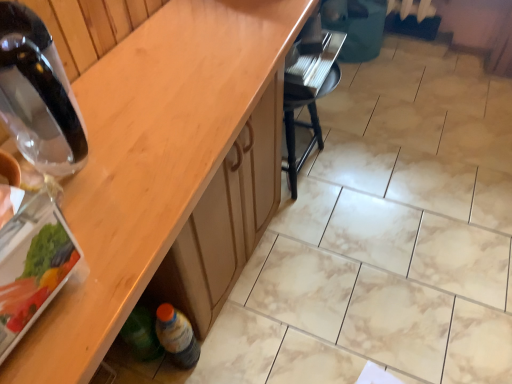
Question: Considering the relative positions of wooden at lower left and translucent plastic bottle at lower left, marked as the 1th bottle in a bottom-to-top arrangement, in the image provided, is wooden at lower left to the left of translucent plastic bottle at lower left, marked as the 1th bottle in a bottom-to-top arrangement, from the viewer's perspective?

Choices:
 (A) yes
 (B) no

Answer: (B)

Question: Considering the relative sizes of wooden at lower left and translucent plastic bottle at lower left, the first bottle from the back, in the image provided, is wooden at lower left shorter than translucent plastic bottle at lower left, the first bottle from the back,?

Choices:
 (A) no
 (B) yes

Answer: (A)

Question: Is wooden at lower left next to translucent plastic bottle at lower left, placed as the 2th bottle when sorted from top to bottom?

Choices:
 (A) yes
 (B) no

Answer: (B)

Question: Can you confirm if wooden at lower left is smaller than translucent plastic bottle at lower left, which is the 2th bottle from front to back?

Choices:
 (A) yes
 (B) no

Answer: (B)

Question: Considering the relative sizes of wooden at lower left and translucent plastic bottle at lower left, which is the 2th bottle from front to back, in the image provided, is wooden at lower left thinner than translucent plastic bottle at lower left, which is the 2th bottle from front to back,?

Choices:
 (A) yes
 (B) no

Answer: (B)

Question: Is point (139, 208) positioned closer to the camera than point (295, 61)?

Choices:
 (A) closer
 (B) farther

Answer: (A)

Question: Is wooden at lower left wider or thinner than black plastic chair at center?

Choices:
 (A) wide
 (B) thin

Answer: (A)

Question: In the image, is wooden at lower left positioned in front of or behind black plastic chair at center?

Choices:
 (A) behind
 (B) front

Answer: (B)

Question: From their relative heights in the image, would you say wooden at lower left is taller or shorter than black plastic chair at center?

Choices:
 (A) tall
 (B) short

Answer: (A)

Question: Considering their positions, is black plastic chair at center located in front of or behind transparent glass bottle at left, the first bottle viewed from the front?

Choices:
 (A) front
 (B) behind

Answer: (B)

Question: In terms of width, does black plastic chair at center look wider or thinner when compared to transparent glass bottle at left, which is the 2th bottle from bottom to top?

Choices:
 (A) wide
 (B) thin

Answer: (B)

Question: Does point click(323, 39) appear closer or farther from the camera than point click(36, 148)?

Choices:
 (A) closer
 (B) farther

Answer: (B)

Question: From a real-world perspective, relative to transparent glass bottle at left, which is the second bottle from back to front, is black plastic chair at center vertically above or below?

Choices:
 (A) above
 (B) below

Answer: (B)

Question: Considering the positions of wooden at lower left and translucent plastic bottle at lower left, the first bottle from the back, in the image, is wooden at lower left bigger or smaller than translucent plastic bottle at lower left, the first bottle from the back,?

Choices:
 (A) small
 (B) big

Answer: (B)

Question: From a real-world perspective, is wooden at lower left physically located above or below translucent plastic bottle at lower left, which is the 2th bottle from front to back?

Choices:
 (A) below
 (B) above

Answer: (B)